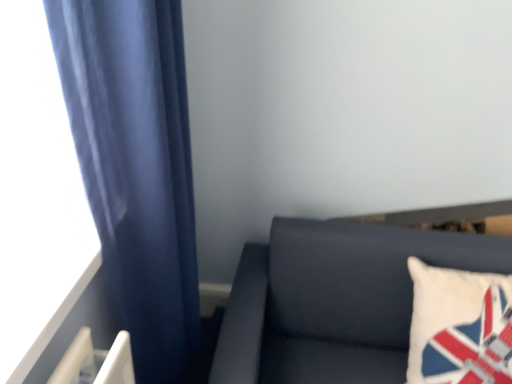
You are a GUI agent. You are given a task and a screenshot of the screen. Output one action in this format:
    pyautogui.click(x=<x>, y=<y>)
    Task: Click on the white fabric pillow at right
    This screenshot has height=384, width=512.
    Given the screenshot: What is the action you would take?
    (x=459, y=326)

At what (x,y) coordinates should I click in order to perform the action: click on satin blue curtain at left. Please return your answer as a coordinate pair (x, y). The width and height of the screenshot is (512, 384). Looking at the image, I should click on (138, 172).

You are a GUI agent. You are given a task and a screenshot of the screen. Output one action in this format:
    pyautogui.click(x=<x>, y=<y>)
    Task: Click on the dark gray fabric couch at lower right
    This screenshot has height=384, width=512.
    Given the screenshot: What is the action you would take?
    pyautogui.click(x=334, y=300)

You are a GUI agent. You are given a task and a screenshot of the screen. Output one action in this format:
    pyautogui.click(x=<x>, y=<y>)
    Task: Click on the pillow behind the dark gray fabric couch at lower right
    This screenshot has width=512, height=384.
    Given the screenshot: What is the action you would take?
    pyautogui.click(x=459, y=326)

From the image's perspective, which object appears higher, dark gray fabric couch at lower right or white fabric pillow at right?

white fabric pillow at right is shown above in the image.

Is dark gray fabric couch at lower right thinner than white fabric pillow at right?

No, dark gray fabric couch at lower right is not thinner than white fabric pillow at right.

Is dark gray fabric couch at lower right in contact with white fabric pillow at right?

No, dark gray fabric couch at lower right is not beside white fabric pillow at right.

Would you say dark gray fabric couch at lower right is a long distance from satin blue curtain at left?

No, dark gray fabric couch at lower right is not far away from satin blue curtain at left.

Is dark gray fabric couch at lower right outside of satin blue curtain at left?

That's correct, dark gray fabric couch at lower right is outside of satin blue curtain at left.

Is dark gray fabric couch at lower right facing towards satin blue curtain at left?

No, dark gray fabric couch at lower right does not turn towards satin blue curtain at left.

From a real-world perspective, who is located lower, dark gray fabric couch at lower right or satin blue curtain at left?

From a 3D spatial view, dark gray fabric couch at lower right is below.

This screenshot has width=512, height=384. In order to click on pillow above the dark gray fabric couch at lower right (from a real-world perspective) in this screenshot , I will do `click(459, 326)`.

Consider the image. Is white fabric pillow at right positioned with its back to dark gray fabric couch at lower right?

Yes, white fabric pillow at right is positioned with its back facing dark gray fabric couch at lower right.

From a real-world perspective, is white fabric pillow at right located beneath dark gray fabric couch at lower right?

No, from a real-world perspective, white fabric pillow at right is not beneath dark gray fabric couch at lower right.

How many degrees apart are the facing directions of white fabric pillow at right and dark gray fabric couch at lower right?

0.000751 degrees.

In terms of width, does satin blue curtain at left look wider or thinner when compared to white fabric pillow at right?

Clearly, satin blue curtain at left has less width compared to white fabric pillow at right.

Visually, is satin blue curtain at left positioned to the left or to the right of white fabric pillow at right?

satin blue curtain at left is positioned on white fabric pillow at right's left side.

Are satin blue curtain at left and white fabric pillow at right making contact?

No, satin blue curtain at left is not making contact with white fabric pillow at right.

Find the location of a particular element. curtain on the left of the white fabric pillow at right is located at coordinates (138, 172).

Which object is positioned more to the left, white fabric pillow at right or satin blue curtain at left?

Positioned to the left is satin blue curtain at left.

Is satin blue curtain at left located within white fabric pillow at right?

No, white fabric pillow at right does not contain satin blue curtain at left.

From the image's perspective, which one is positioned lower, satin blue curtain at left or dark gray fabric couch at lower right?

dark gray fabric couch at lower right is shown below in the image.

Between satin blue curtain at left and dark gray fabric couch at lower right, which one is positioned behind?

dark gray fabric couch at lower right is further from the camera.

Is satin blue curtain at left taller or shorter than dark gray fabric couch at lower right?

Clearly, satin blue curtain at left is taller compared to dark gray fabric couch at lower right.

Is dark gray fabric couch at lower right at the back of satin blue curtain at left?

No, satin blue curtain at left is not facing away from dark gray fabric couch at lower right.

At what (x,y) coordinates should I click in order to perform the action: click on pillow to the right of dark gray fabric couch at lower right. Please return your answer as a coordinate pair (x, y). The width and height of the screenshot is (512, 384). Looking at the image, I should click on (459, 326).

Identify the location of furniture located behind the satin blue curtain at left. This screenshot has height=384, width=512. (334, 300).

When comparing their distances from white fabric pillow at right, does satin blue curtain at left or dark gray fabric couch at lower right seem further?

satin blue curtain at left is further to white fabric pillow at right.

Considering their positions, is white fabric pillow at right positioned closer to satin blue curtain at left than dark gray fabric couch at lower right?

dark gray fabric couch at lower right.

Estimate the real-world distances between objects in this image. Which object is further from white fabric pillow at right, dark gray fabric couch at lower right or satin blue curtain at left?

The object further to white fabric pillow at right is satin blue curtain at left.

From the image, which object appears to be nearer to dark gray fabric couch at lower right, white fabric pillow at right or satin blue curtain at left?

white fabric pillow at right is positioned closer to the anchor dark gray fabric couch at lower right.

Estimate the real-world distances between objects in this image. Which object is closer to dark gray fabric couch at lower right, satin blue curtain at left or white fabric pillow at right?

Among the two, white fabric pillow at right is located nearer to dark gray fabric couch at lower right.

Considering their positions, is dark gray fabric couch at lower right positioned closer to satin blue curtain at left than white fabric pillow at right?

dark gray fabric couch at lower right is closer to satin blue curtain at left.

Image resolution: width=512 pixels, height=384 pixels. Identify the location of furniture between satin blue curtain at left and white fabric pillow at right in the horizontal direction. (334, 300).